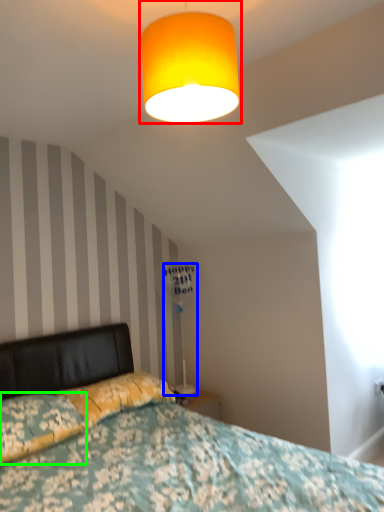
Question: Considering the real-world distances, which object is farthest from lamp (highlighted by a red box)? table lamp (highlighted by a blue box) or pillow (highlighted by a green box)?

Choices:
 (A) table lamp
 (B) pillow

Answer: (A)